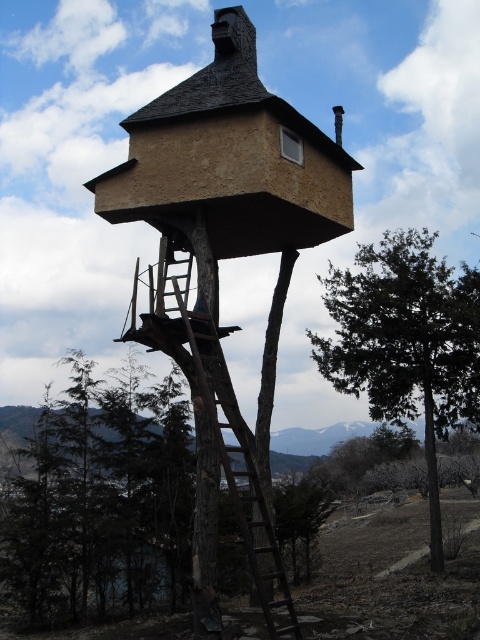
Is point (456, 333) positioned after point (279, 602)?

Yes, point (456, 333) is farther from viewer.

Can you confirm if green leafy tree at center is wider than brown wooden ladder at center?

Yes, green leafy tree at center is wider than brown wooden ladder at center.

Is point (360, 380) less distant than point (188, 273)?

That is False.

This screenshot has height=640, width=480. Find the location of `green leafy tree at center`. green leafy tree at center is located at coordinates (406, 342).